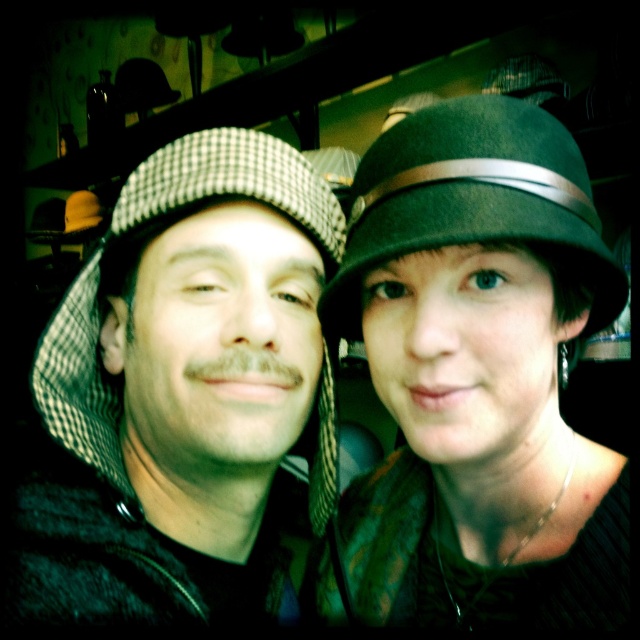
Does green felt hat at upper center have a smaller size compared to green felt fedora at center?

No.

Does point (596, 460) lie behind point (413, 209)?

Yes, point (596, 460) is farther from viewer.

The width and height of the screenshot is (640, 640). Identify the location of green felt hat at upper center. (477, 372).

Is green felt hat at upper center positioned behind checkered fabric hat at left?

No, it is in front of checkered fabric hat at left.

The image size is (640, 640). What do you see at coordinates (477, 372) in the screenshot?
I see `green felt hat at upper center` at bounding box center [477, 372].

Which is in front, point (449, 324) or point (220, 252)?

Point (449, 324) is more forward.

Image resolution: width=640 pixels, height=640 pixels. Find the location of `green felt hat at upper center`. green felt hat at upper center is located at coordinates (477, 372).

Which of these two, checkered fabric hat at left or green felt fedora at center, stands taller?

checkered fabric hat at left

Can you confirm if checkered fabric hat at left is positioned above green felt fedora at center?

No, checkered fabric hat at left is not above green felt fedora at center.

This screenshot has height=640, width=640. What are the coordinates of `checkered fabric hat at left` in the screenshot? It's located at (177, 392).